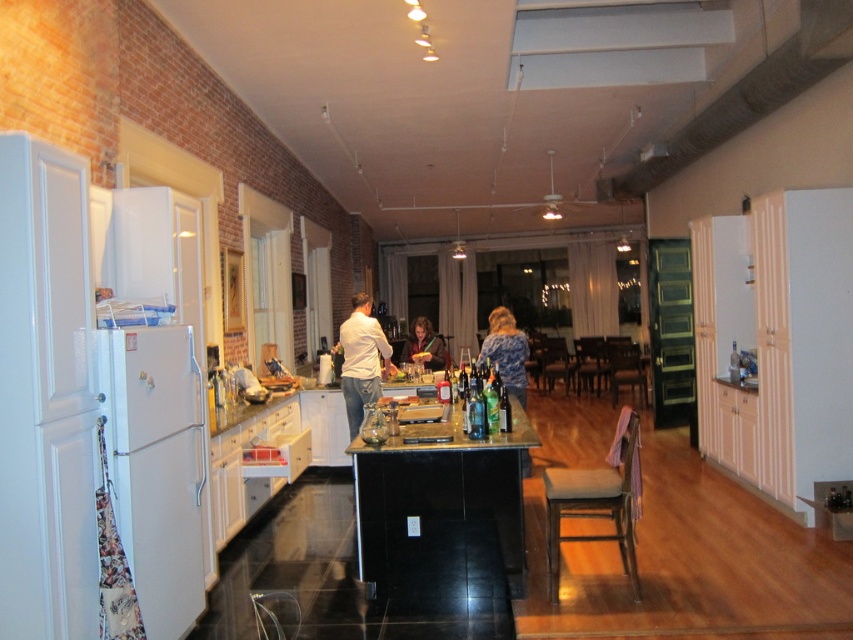
Is white cotton shirt at center positioned behind blue textured sweater at center?

Yes, white cotton shirt at center is behind blue textured sweater at center.

This screenshot has width=853, height=640. What do you see at coordinates (361, 358) in the screenshot? I see `white cotton shirt at center` at bounding box center [361, 358].

Where is `white cotton shirt at center`? white cotton shirt at center is located at coordinates (361, 358).

Based on the photo, which of these two, brown cushioned stool at lower center or matte brown hair at center, stands shorter?

matte brown hair at center is shorter.

Can you confirm if brown cushioned stool at lower center is positioned below matte brown hair at center?

Correct, brown cushioned stool at lower center is located below matte brown hair at center.

Does point (560, 477) lie in front of point (431, 364)?

Yes, point (560, 477) is in front of point (431, 364).

Where is `brown cushioned stool at lower center`? Image resolution: width=853 pixels, height=640 pixels. brown cushioned stool at lower center is located at coordinates (589, 513).

Is brown cushioned stool at lower center shorter than blue textured sweater at center?

Indeed, brown cushioned stool at lower center has a lesser height compared to blue textured sweater at center.

Is point (561, 506) less distant than point (491, 360)?

Yes, it is.

Identify the location of brown cushioned stool at lower center. The height and width of the screenshot is (640, 853). (589, 513).